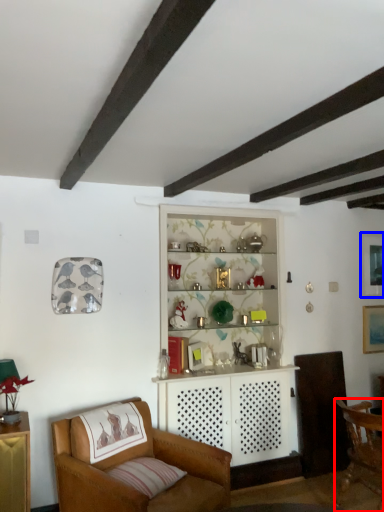
Question: Which of the following is the closest to the observer, chair (highlighted by a red box) or picture frame (highlighted by a blue box)?

Choices:
 (A) chair
 (B) picture frame

Answer: (A)